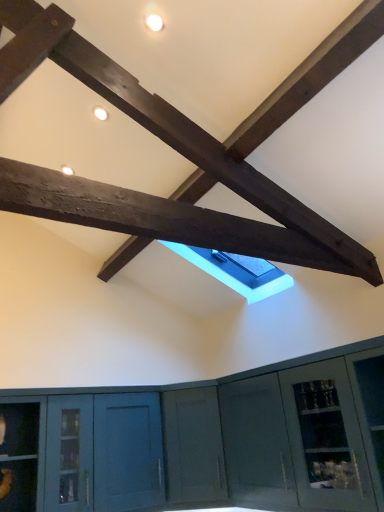
Question: Should I look upward or downward to see dark brown wood beam at center?

Choices:
 (A) up
 (B) down

Answer: (A)